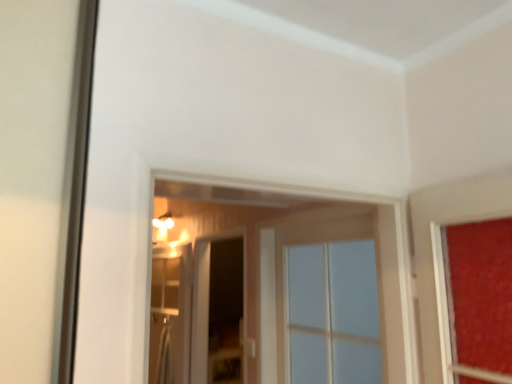
Question: Which direction should I rotate to look at clear glass screen door at center, arranged as the second screen door when viewed from the right?

Choices:
 (A) right
 (B) left

Answer: (B)

Question: Is the position of clear glass screen door at center, which ranks as the second screen door in left-to-right order, less distant than that of clear glass window at center?

Choices:
 (A) yes
 (B) no

Answer: (B)

Question: Is clear glass screen door at center, which ranks as the second screen door in left-to-right order, shorter than clear glass window at center?

Choices:
 (A) yes
 (B) no

Answer: (B)

Question: From a real-world perspective, is clear glass screen door at center, which ranks as the second screen door in left-to-right order, located beneath clear glass window at center?

Choices:
 (A) no
 (B) yes

Answer: (B)

Question: Can you confirm if clear glass screen door at center, marked as the 1th screen door in a right-to-left arrangement, is bigger than clear glass window at center?

Choices:
 (A) yes
 (B) no

Answer: (B)

Question: From the image's perspective, is clear glass screen door at center, marked as the 1th screen door in a right-to-left arrangement, on clear glass window at center?

Choices:
 (A) yes
 (B) no

Answer: (B)

Question: Considering the relative sizes of clear glass screen door at center, marked as the 1th screen door in a right-to-left arrangement, and clear glass window at center in the image provided, is clear glass screen door at center, marked as the 1th screen door in a right-to-left arrangement, wider than clear glass window at center?

Choices:
 (A) no
 (B) yes

Answer: (A)

Question: Is clear glass screen door at center, arranged as the second screen door when viewed from the right, closer to camera compared to clear glass window at center?

Choices:
 (A) no
 (B) yes

Answer: (A)

Question: From a real-world perspective, does clear glass screen door at center, arranged as the second screen door when viewed from the right, sit lower than clear glass window at center?

Choices:
 (A) no
 (B) yes

Answer: (B)

Question: Is clear glass screen door at center, placed as the 1th screen door when sorted from left to right, far from clear glass window at center?

Choices:
 (A) yes
 (B) no

Answer: (A)

Question: From the image's perspective, does clear glass screen door at center, arranged as the second screen door when viewed from the right, appear higher than clear glass window at center?

Choices:
 (A) no
 (B) yes

Answer: (A)

Question: Can you confirm if clear glass screen door at center, arranged as the second screen door when viewed from the right, is bigger than clear glass window at center?

Choices:
 (A) yes
 (B) no

Answer: (B)

Question: From a real-world perspective, is clear glass screen door at center, placed as the 1th screen door when sorted from left to right, physically above clear glass window at center?

Choices:
 (A) yes
 (B) no

Answer: (B)

Question: Is clear glass window at center smaller than clear glass screen door at center, which ranks as the second screen door in left-to-right order?

Choices:
 (A) no
 (B) yes

Answer: (A)